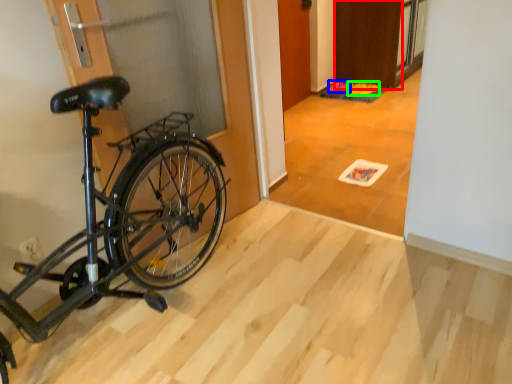
Question: Based on their relative distances, which object is farther from door (highlighted by a red box)? Choose from walking shoe (highlighted by a blue box) and walking shoe (highlighted by a green box).

Choices:
 (A) walking shoe
 (B) walking shoe

Answer: (A)